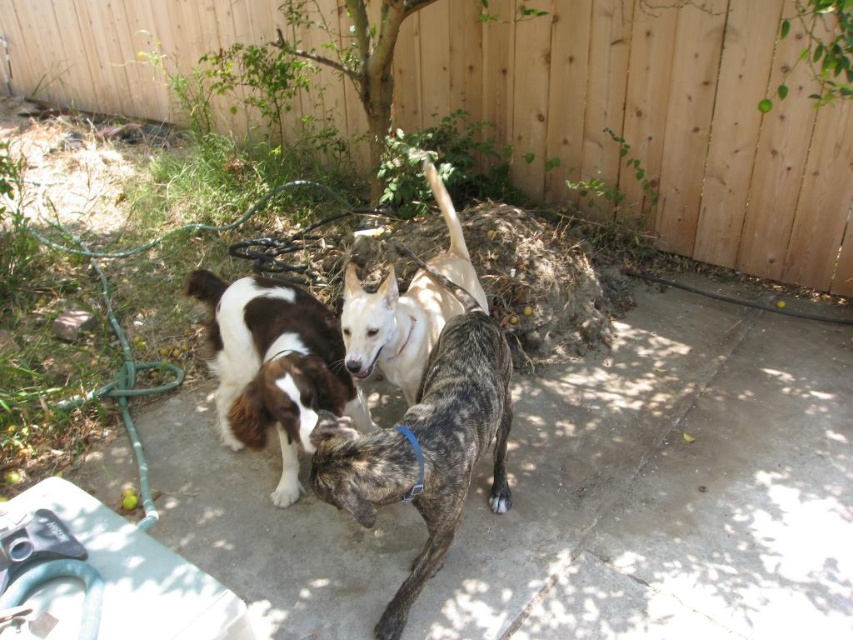
You are a dog owner who wants to ensure your white smooth dog at center stays within the yard. The wooden fence at upper center is the boundary. Can the dog reach the fence if it runs straight towards it?

The distance between the wooden fence at upper center and the white smooth dog at center is 5.40 feet. Since the dog can easily cover that distance by running straight, yes, the dog can reach the fence.

You are standing in the backyard and want to locate the wooden fence at upper center. What are the coordinates where you can find it?

The wooden fence at upper center is located at coordinates point (653, 120).

You are standing in the backyard and want to pet the brindle fur dog at center and the white smooth dog at center. Which dog should you approach first to reach the one closer to you?

You should approach the brindle fur dog at center first because it is closer to you than the white smooth dog at center.